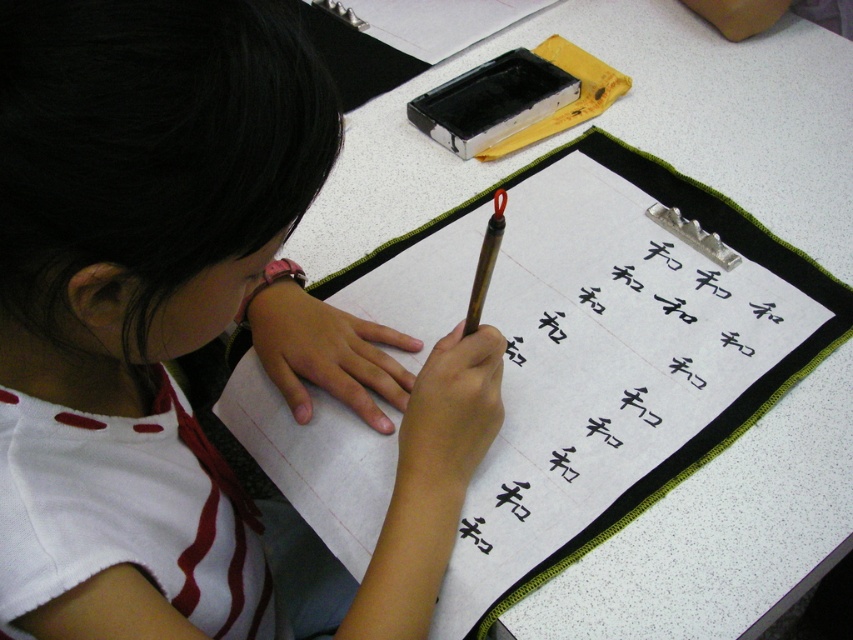
You are a teacher observing a student practicing calligraphy. The student has a black fabric clipboard at center and a brown wooden pencil at center on the desk. Which object is taller?

The black fabric clipboard at center is taller than the brown wooden pencil at center.

You are a photographer trying to capture a closeup of the black fabric clipboard at center. However, the white fabric shirt at center is blocking your view. Can you still see the clipboard through the shirt?

The white fabric shirt at center is closer to the viewer than the black fabric clipboard at center, so the shirt is blocking the view of the clipboard. You cannot see the clipboard through the shirt.